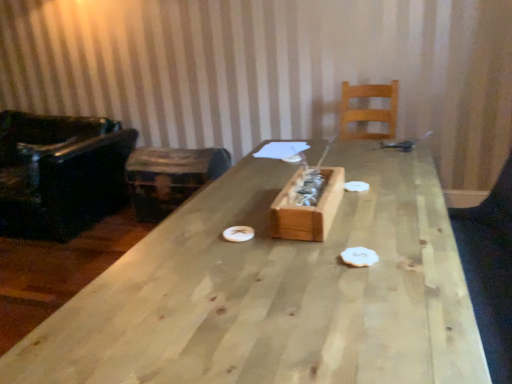
This screenshot has width=512, height=384. In order to click on free spot above natural wood table at center (from a real-world perspective) in this screenshot , I will do `click(311, 240)`.